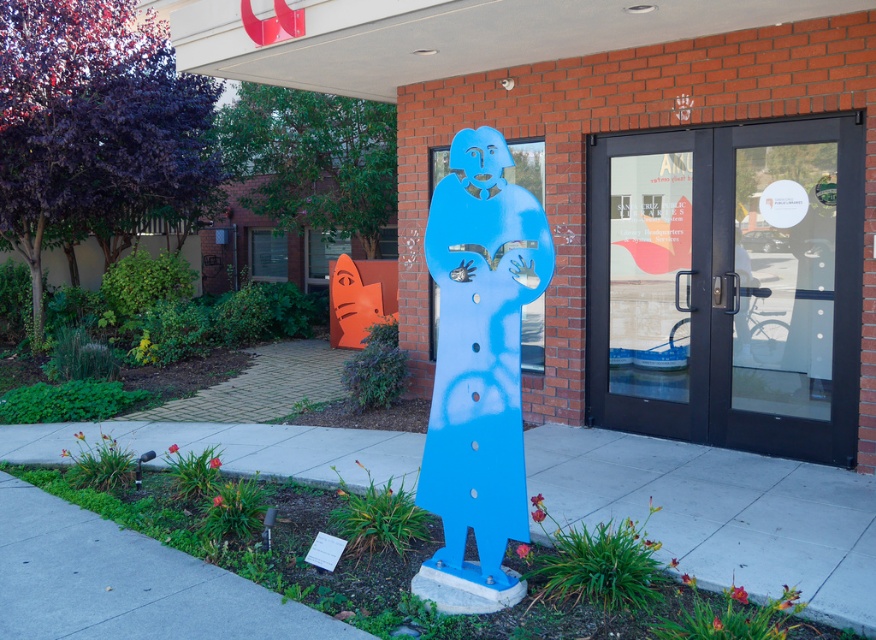
What do you see at coordinates (728, 285) in the screenshot?
I see `black glass doors at center` at bounding box center [728, 285].

You are a GUI agent. You are given a task and a screenshot of the screen. Output one action in this format:
    pyautogui.click(x=<x>, y=<y>)
    Task: Click on the black glass doors at center
    This screenshot has height=640, width=876.
    Given the screenshot: What is the action you would take?
    pyautogui.click(x=728, y=285)

Identify the location of black glass doors at center. Image resolution: width=876 pixels, height=640 pixels. (728, 285).